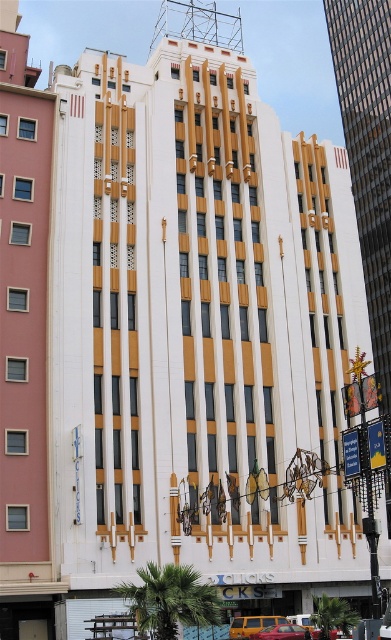
Who is positioned more to the right, matte red car at center or metallic gold car at center?

metallic gold car at center is more to the right.

Is matte red car at center shorter than metallic gold car at center?

No, matte red car at center is not shorter than metallic gold car at center.

Where is `matte red car at center`? The width and height of the screenshot is (391, 640). matte red car at center is located at coordinates coord(283,632).

Locate an element on the screen. This screenshot has height=640, width=391. matte red car at center is located at coordinates (283, 632).

Is pink matte building at left below matte red car at center?

No.

Is point (10, 582) positioned in front of point (303, 634)?

Yes, point (10, 582) is in front of point (303, 634).

Image resolution: width=391 pixels, height=640 pixels. What are the coordinates of `pink matte building at left` in the screenshot? It's located at (23, 339).

Does pink matte building at left appear over metallic gold car at center?

Indeed, pink matte building at left is positioned over metallic gold car at center.

Is point (1, 380) behind point (313, 630)?

No, (1, 380) is closer to viewer.

I want to click on pink matte building at left, so click(x=23, y=339).